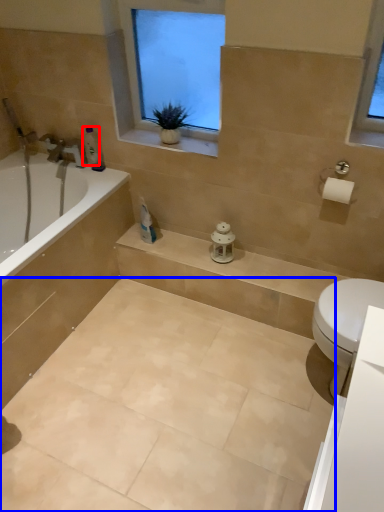
Question: Which object appears closest to the camera in this image, toiletry (highlighted by a red box) or ceramic tile (highlighted by a blue box)?

Choices:
 (A) toiletry
 (B) ceramic tile

Answer: (B)